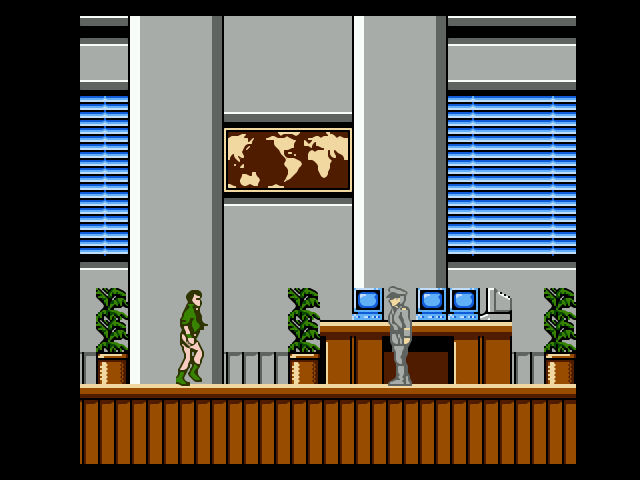
This screenshot has height=480, width=640. In order to click on computer in this screenshot , I will do `click(372, 303)`, `click(432, 310)`, `click(456, 308)`, `click(500, 307)`.